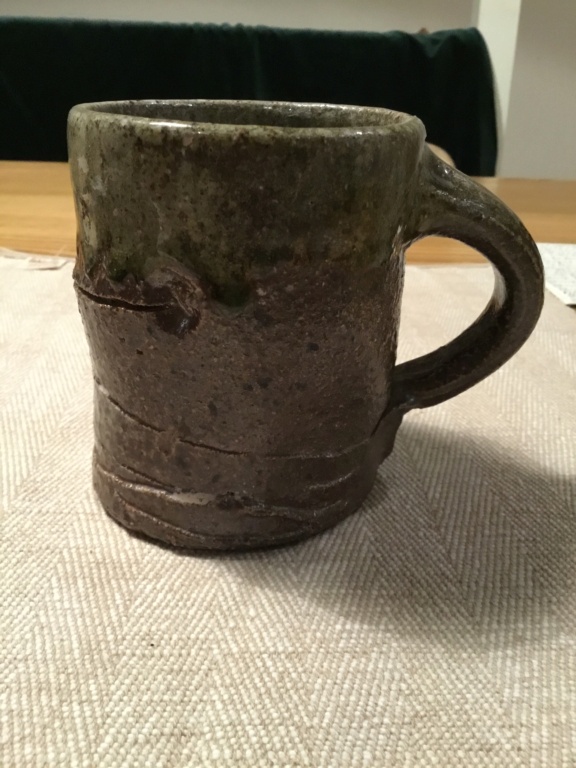
The image size is (576, 768). I want to click on table, so click(545, 200).